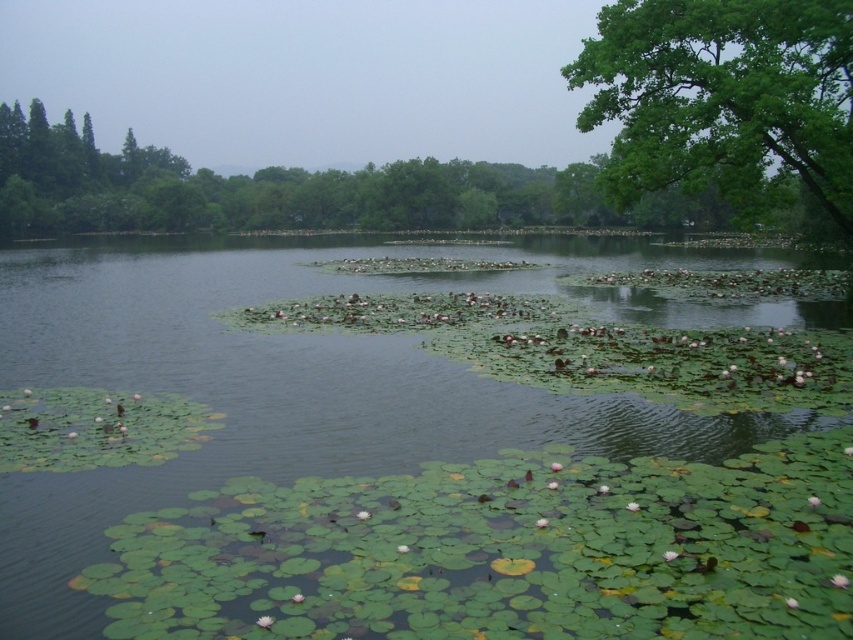
Which is above, green leafy water at center or green leafy tree at upper right?

green leafy tree at upper right

Can you confirm if green leafy water at center is positioned above green leafy tree at upper right?

No.

What do you see at coordinates (277, 387) in the screenshot? The image size is (853, 640). I see `green leafy water at center` at bounding box center [277, 387].

Locate an element on the screen. green leafy water at center is located at coordinates (277, 387).